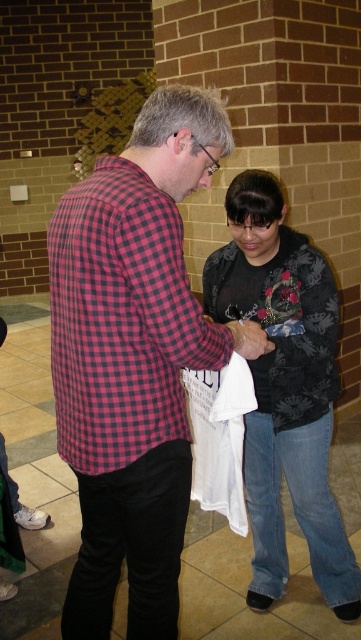
You are standing in the room and want to give a gift to the person wearing the plaid shirt at center. The gift is too large to hand directly, so you decide to place it on the floor between the two people. Where should you put the gift relative to the dark floral sweater at center?

You should place the gift to the left of the dark floral sweater at center, as the plaid shirt at center is located to the left of the dark floral sweater at center.

You are observing two people in a room. You see a plaid shirt at center and a plaid fabric shirt at left. Which one is closer to the right side of the room?

The plaid shirt at center is positioned on the right side of plaid fabric shirt at left, so it is closer to the right side of the room.